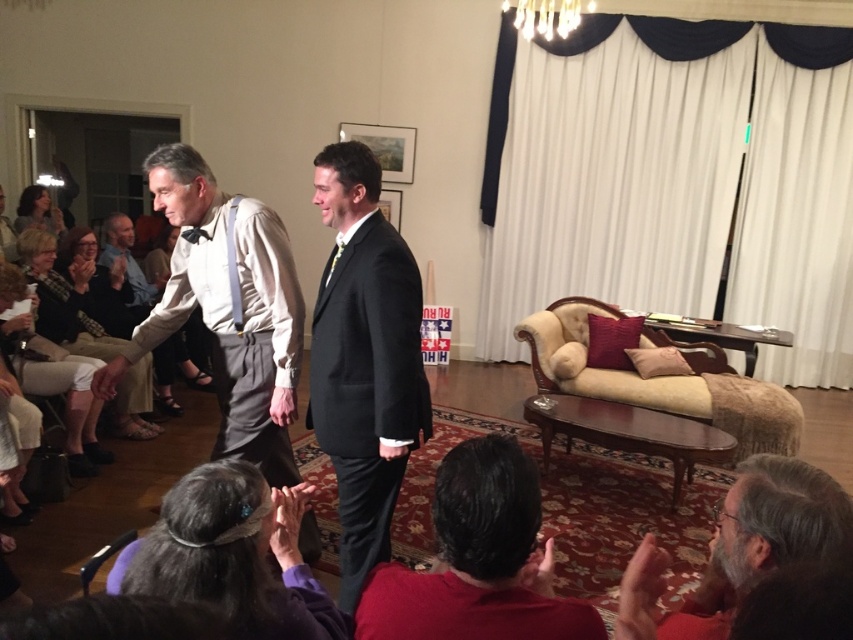
Is point (318, 609) farther from viewer compared to point (106, 288)?

No, it is in front of (106, 288).

Is point (294, 509) positioned in front of point (108, 289)?

That is True.

Which is in front, point (213, 467) or point (90, 337)?

Positioned in front is point (213, 467).

The image size is (853, 640). Find the location of `purple fabric headband at lower center`. purple fabric headband at lower center is located at coordinates (233, 554).

Does dark red sweater at lower center have a larger size compared to light beige pants at lower left?

No, dark red sweater at lower center is not bigger than light beige pants at lower left.

Does dark red sweater at lower center lie in front of light beige pants at lower left?

Yes, it is in front of light beige pants at lower left.

What do you see at coordinates (479, 561) in the screenshot?
I see `dark red sweater at lower center` at bounding box center [479, 561].

Identify the location of dark red sweater at lower center. The height and width of the screenshot is (640, 853). (x=479, y=561).

Does point (418, 572) lie behind point (44, 227)?

That is False.

Between point (473, 525) and point (25, 205), which one is positioned behind?

Positioned behind is point (25, 205).

At what (x,y) coordinates should I click in order to perform the action: click on dark red sweater at lower center. Please return your answer as a coordinate pair (x, y). The image size is (853, 640). Looking at the image, I should click on (479, 561).